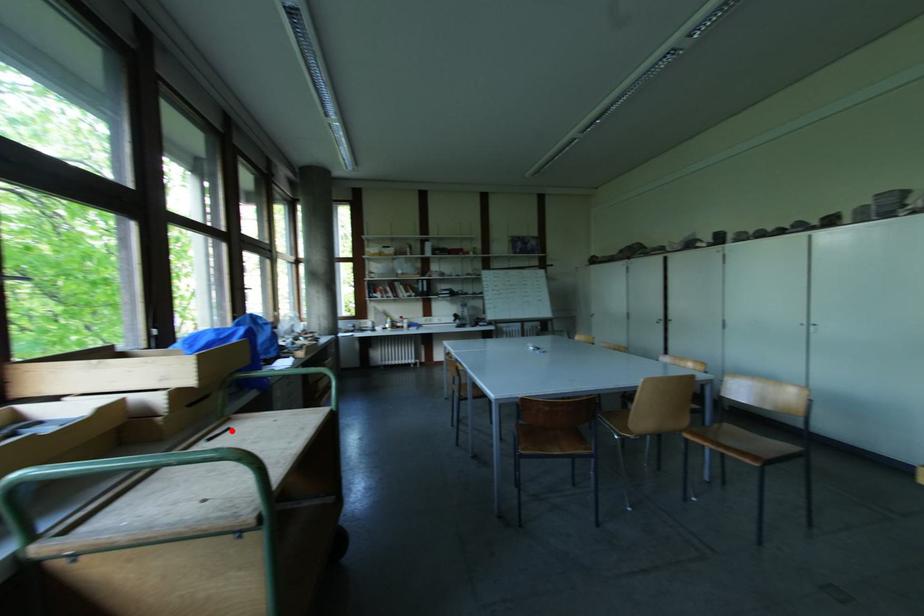
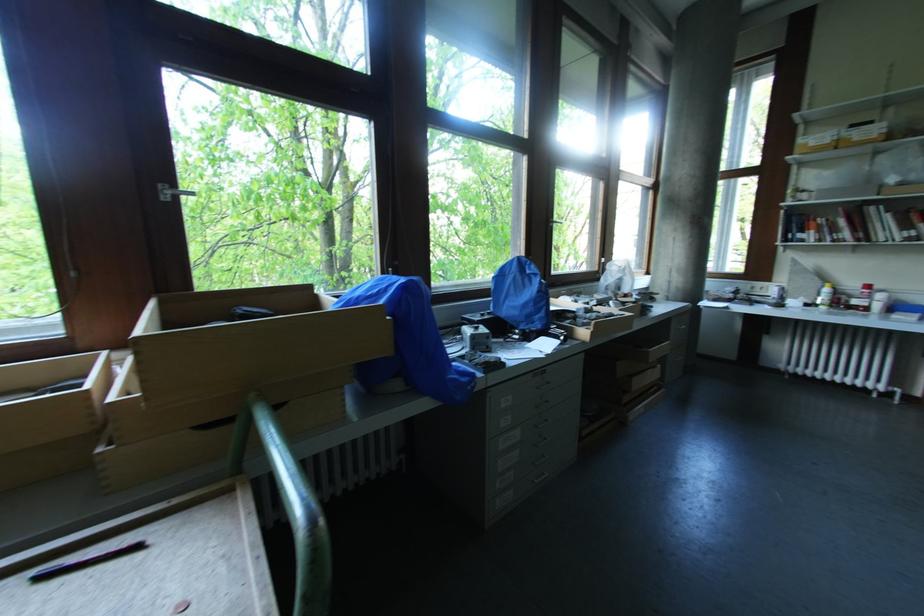
Find the pixel in the second image that matches the highlighted location in the first image.

(140, 549)